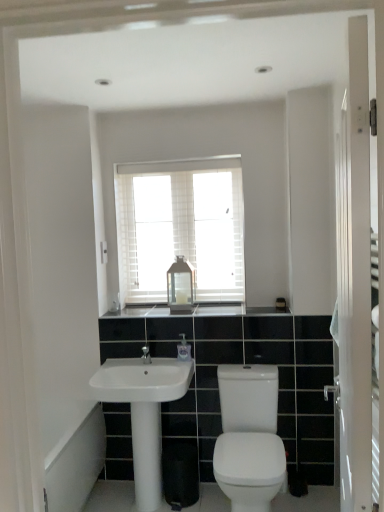
The image size is (384, 512). Identify the location of unoccupied area in front of translucent plastic soap dispenser at center. (170, 366).